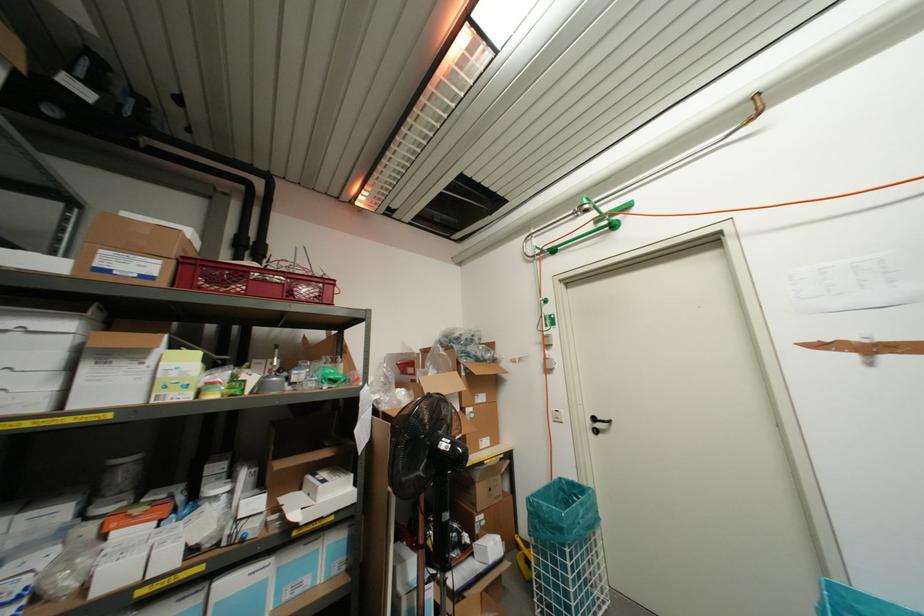
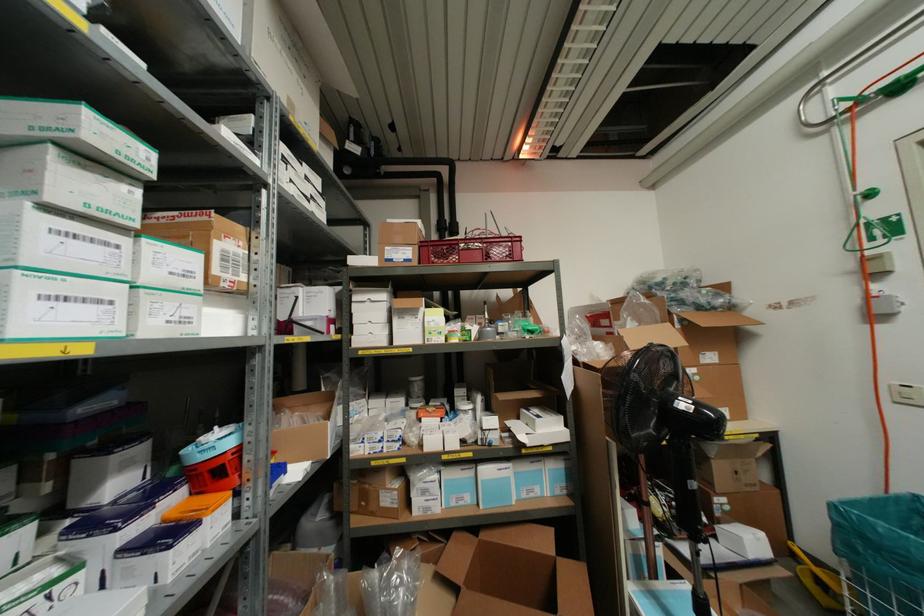
Question: The camera is either moving clockwise (left) or counter-clockwise (right) around the object. The first image is from the beginning of the video and the second image is from the end. Is the camera moving left or right when shooting the video?

Choices:
 (A) Left
 (B) Right

Answer: (B)